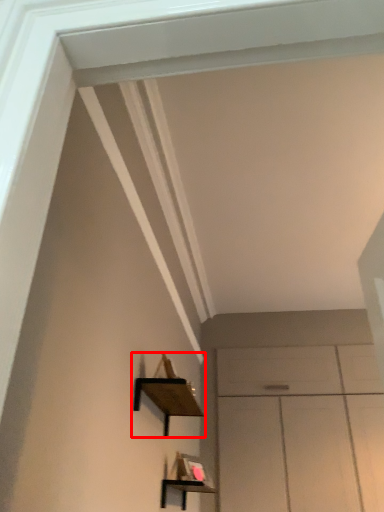
Question: From the image's perspective, what is the correct spatial relationship of shelf (annotated by the red box) in relation to shelf?

Choices:
 (A) below
 (B) above

Answer: (B)